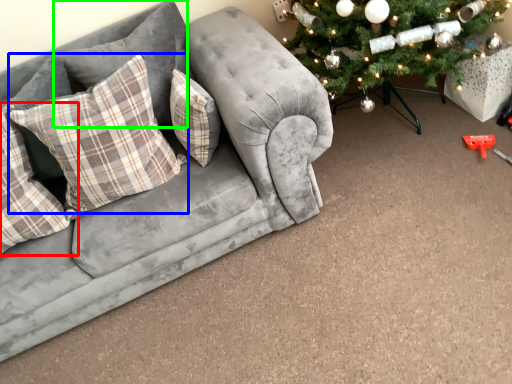
Question: Estimate the real-world distances between objects in this image. Which object is farther from pillow (highlighted by a red box), pillow (highlighted by a blue box) or pillow (highlighted by a green box)?

Choices:
 (A) pillow
 (B) pillow

Answer: (B)